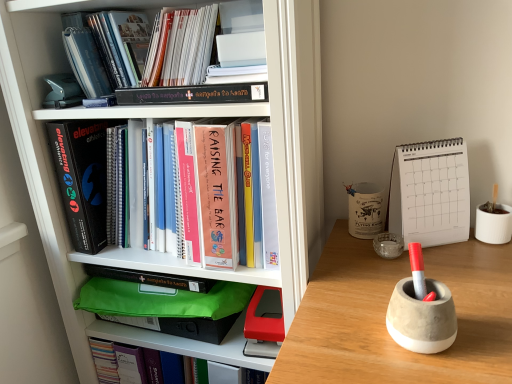
Question: Can you confirm if green matte folder at center, positioned as the first book in bottom-to-top order, is positioned to the right of white matte bookcase at left?

Choices:
 (A) no
 (B) yes

Answer: (A)

Question: From the image's perspective, would you say green matte folder at center, which ranks as the fourth book in top-to-bottom order, is shown under white matte bookcase at left?

Choices:
 (A) no
 (B) yes

Answer: (B)

Question: Can you confirm if green matte folder at center, which ranks as the fourth book in top-to-bottom order, is taller than white matte bookcase at left?

Choices:
 (A) yes
 (B) no

Answer: (B)

Question: Considering the relative sizes of green matte folder at center, which ranks as the fourth book in top-to-bottom order, and white matte bookcase at left in the image provided, is green matte folder at center, which ranks as the fourth book in top-to-bottom order, smaller than white matte bookcase at left?

Choices:
 (A) no
 (B) yes

Answer: (B)

Question: Can you confirm if green matte folder at center, which ranks as the fourth book in top-to-bottom order, is thinner than white matte bookcase at left?

Choices:
 (A) yes
 (B) no

Answer: (A)

Question: Could you tell me if green matte folder at center, which ranks as the fourth book in top-to-bottom order, is turned towards white matte bookcase at left?

Choices:
 (A) yes
 (B) no

Answer: (A)

Question: Is black matte book at left, the second paperback book positioned from the right, aimed at concrete pen holder at right, the third stationery positioned from the back?

Choices:
 (A) no
 (B) yes

Answer: (A)

Question: From the image's perspective, is black matte book at left, which ranks as the first paperback book in left-to-right order, beneath concrete pen holder at right, the 1th stationery viewed from the front?

Choices:
 (A) no
 (B) yes

Answer: (A)

Question: Is black matte book at left, the second paperback book positioned from the right, smaller than concrete pen holder at right, the third stationery positioned from the back?

Choices:
 (A) no
 (B) yes

Answer: (A)

Question: Are black matte book at left, the second paperback book positioned from the right, and concrete pen holder at right, which is the first stationery from bottom to top, located far from each other?

Choices:
 (A) yes
 (B) no

Answer: (B)

Question: From a real-world perspective, is black matte book at left, the second paperback book positioned from the right, under concrete pen holder at right, the 1th stationery viewed from the front?

Choices:
 (A) yes
 (B) no

Answer: (B)

Question: Is black matte book at left, which ranks as the first paperback book in left-to-right order, positioned beyond the bounds of concrete pen holder at right, the 1th stationery viewed from the front?

Choices:
 (A) no
 (B) yes

Answer: (B)

Question: Is concrete pen holder at right, which is the first stationery from bottom to top, surrounded by hardcover book at upper center, which ranks as the 3th book in top-to-bottom order?

Choices:
 (A) no
 (B) yes

Answer: (A)